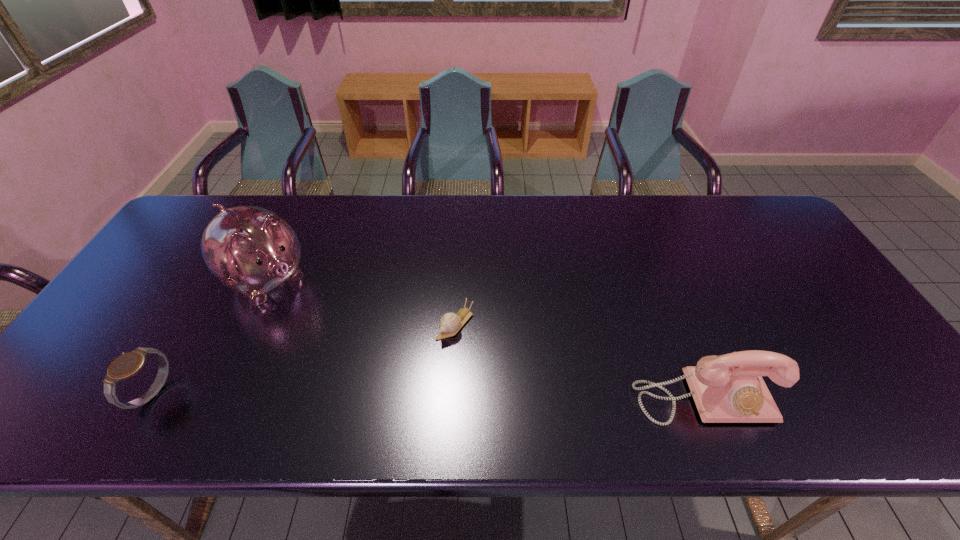
The image size is (960, 540). What are the coordinates of `vacant area that lies between the tallest object and the second tallest object` in the screenshot? It's located at (485, 338).

Find the location of `empty space that is in between the third shortest object and the shortest object`. empty space that is in between the third shortest object and the shortest object is located at coordinates (580, 361).

Where is `vacant space that is in between the third object from left to right and the tallest object`? vacant space that is in between the third object from left to right and the tallest object is located at coordinates (361, 302).

Find the location of `free space between the rightmost object and the second object from right to left`. free space between the rightmost object and the second object from right to left is located at coordinates (580, 361).

Locate an element on the screen. vacant area that lies between the rightmost object and the watch is located at coordinates (428, 395).

At what (x,y) coordinates should I click in order to perform the action: click on empty space that is in between the third tallest object and the telephone. Please return your answer as a coordinate pair (x, y). Image resolution: width=960 pixels, height=540 pixels. Looking at the image, I should click on (428, 395).

This screenshot has width=960, height=540. What are the coordinates of `free area in between the watch and the piggy bank` in the screenshot? It's located at point(209,336).

The image size is (960, 540). Find the location of `vacant area that lies between the third tallest object and the rightmost object`. vacant area that lies between the third tallest object and the rightmost object is located at coordinates (428, 395).

Choose which object is the second nearest neighbor to the rightmost object. Please provide its 2D coordinates. Your answer should be formatted as a tuple, i.e. [(x, y)], where the tuple contains the x and y coordinates of a point satisfying the conditions above.

[(252, 250)]

Image resolution: width=960 pixels, height=540 pixels. I want to click on object that stands as the second closest to the tallest object, so click(450, 323).